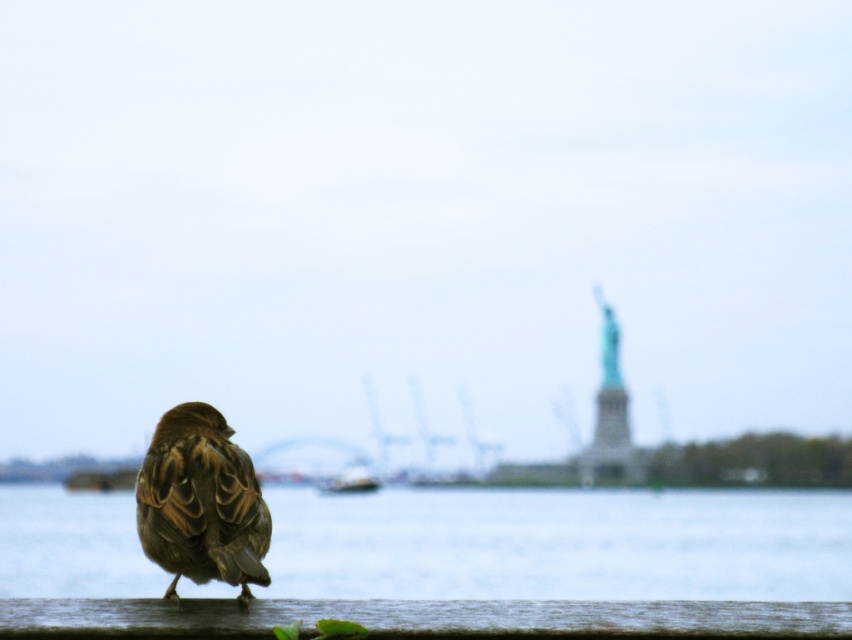
Question: From the image, what is the correct spatial relationship of brown wooden rail at lower center in relation to white plastic boat at center?

Choices:
 (A) right
 (B) left

Answer: (A)

Question: Which is farther from the brown feathered sparrow at lower left?

Choices:
 (A) white plastic boat at center
 (B) smooth water at lower center

Answer: (A)

Question: Which point is farther to the camera?

Choices:
 (A) brown wooden rail at lower center
 (B) brown feathered sparrow at lower left
 (C) smooth water at lower center
 (D) white plastic boat at center

Answer: (D)

Question: Estimate the real-world distances between objects in this image. Which object is farther from the white plastic boat at center?

Choices:
 (A) brown feathered sparrow at lower left
 (B) brown wooden rail at lower center
 (C) smooth water at lower center

Answer: (B)

Question: Where is smooth water at lower center located in relation to brown wooden rail at lower center in the image?

Choices:
 (A) left
 (B) right

Answer: (B)

Question: From the image, what is the correct spatial relationship of smooth water at lower center in relation to brown feathered sparrow at lower left?

Choices:
 (A) above
 (B) below

Answer: (B)